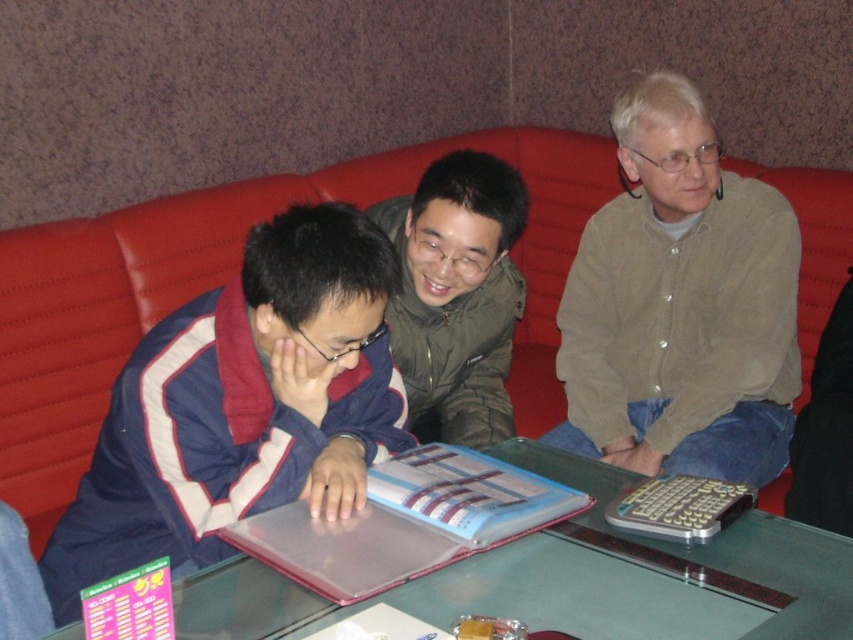
Question: Among these objects, which one is farthest from the camera?

Choices:
 (A) green matte jacket at center
 (B) red leather couch at center
 (C) light brown button-down shirt at right
 (D) blue fabric jacket at center

Answer: (B)

Question: Does light brown button-down shirt at right appear on the left side of green matte jacket at center?

Choices:
 (A) yes
 (B) no

Answer: (B)

Question: Which is farther from the transparent plastic folder at center?

Choices:
 (A) red leather couch at center
 (B) green matte jacket at center
 (C) light brown button-down shirt at right

Answer: (A)

Question: Is the position of transparent plastic folder at center less distant than that of green matte jacket at center?

Choices:
 (A) yes
 (B) no

Answer: (A)

Question: Which point is farther to the camera?

Choices:
 (A) red leather couch at center
 (B) transparent plastic folder at center
 (C) light brown button-down shirt at right

Answer: (A)

Question: Is red leather couch at center wider than green matte jacket at center?

Choices:
 (A) yes
 (B) no

Answer: (A)